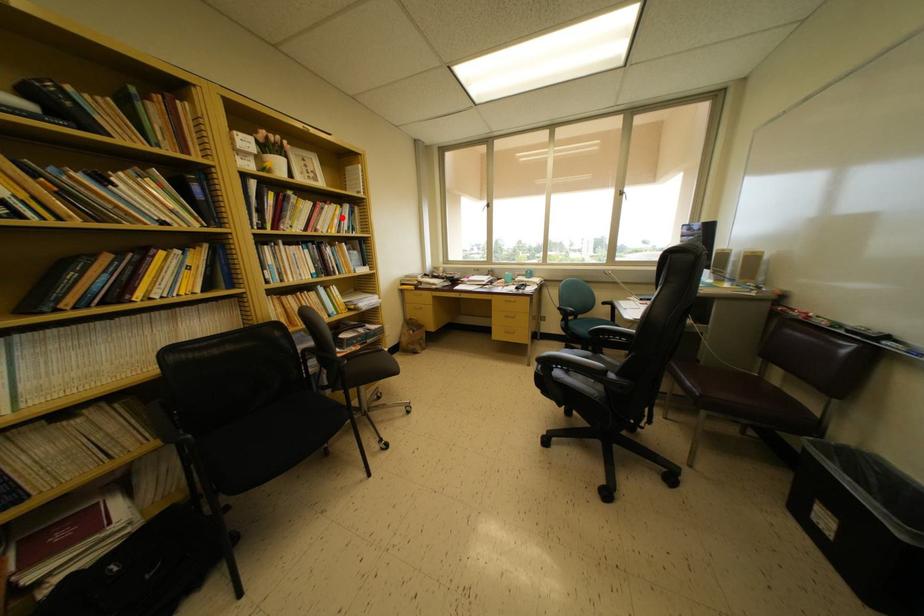
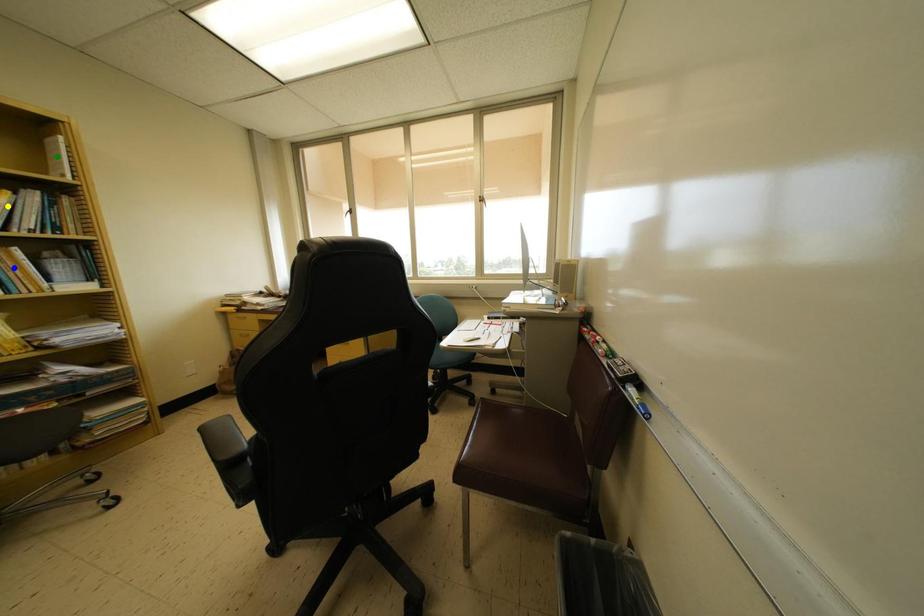
Question: I am providing you with two images of the same scene from different viewpoints. A red point is marked on the first image. You are given multiple points on the second image. Which spot in image 2 lines up with the point in image 1?

Choices:
 (A) blue point
 (B) yellow point
 (C) green point

Answer: (B)